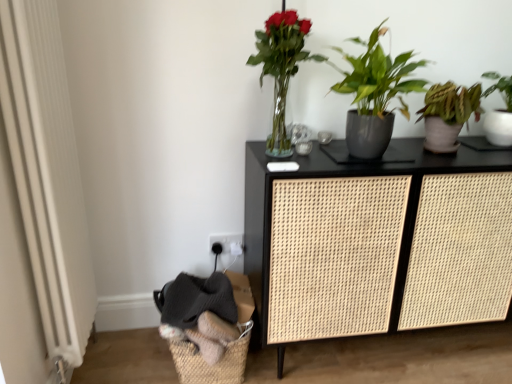
Locate an element on the screen. free space to the left of woven natural basket at lower left is located at coordinates (135, 354).